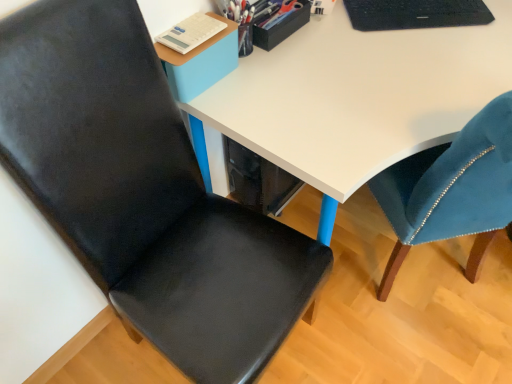
Identify the location of free space in front of black textured laptop at upper right. The image size is (512, 384). (415, 71).